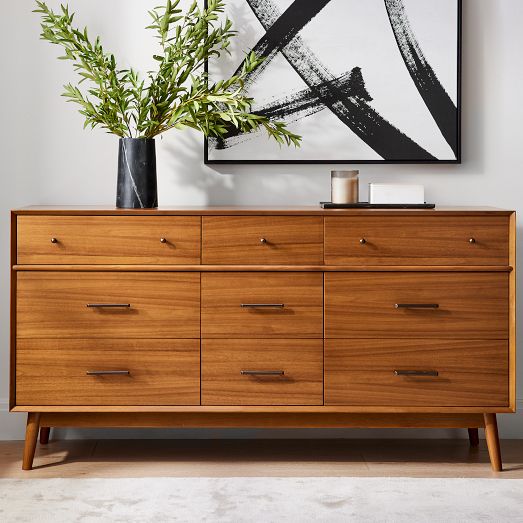
Identify the location of white rug. (260, 509).